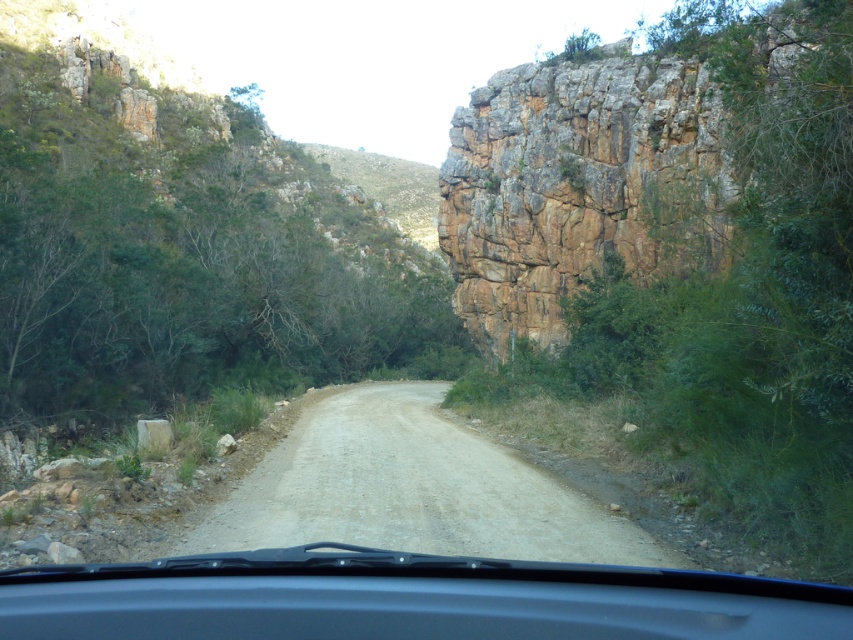
Is the position of brown rough rock face at right less distant than that of transparent plastic windshield at center?

No, it is not.

Is point (473, 136) more distant than point (97, 602)?

Yes, point (473, 136) is behind point (97, 602).

Which is in front, point (764, 97) or point (51, 566)?

Point (51, 566)

I want to click on brown rough rock face at right, so click(651, 161).

Describe the element at coordinates (651, 161) in the screenshot. I see `brown rough rock face at right` at that location.

Image resolution: width=853 pixels, height=640 pixels. What do you see at coordinates (651, 161) in the screenshot? I see `brown rough rock face at right` at bounding box center [651, 161].

At what (x,y) coordinates should I click in order to perform the action: click on brown rough rock face at right. Please return your answer as a coordinate pair (x, y). The width and height of the screenshot is (853, 640). Looking at the image, I should click on tap(651, 161).

Describe the element at coordinates (405, 598) in the screenshot. This screenshot has width=853, height=640. I see `transparent plastic windshield at center` at that location.

Is transparent plastic windshield at center positioned behind dusty gravel road at center?

No.

Describe the element at coordinates (405, 598) in the screenshot. The height and width of the screenshot is (640, 853). I see `transparent plastic windshield at center` at that location.

In order to click on transparent plastic windshield at center in this screenshot , I will do `click(405, 598)`.